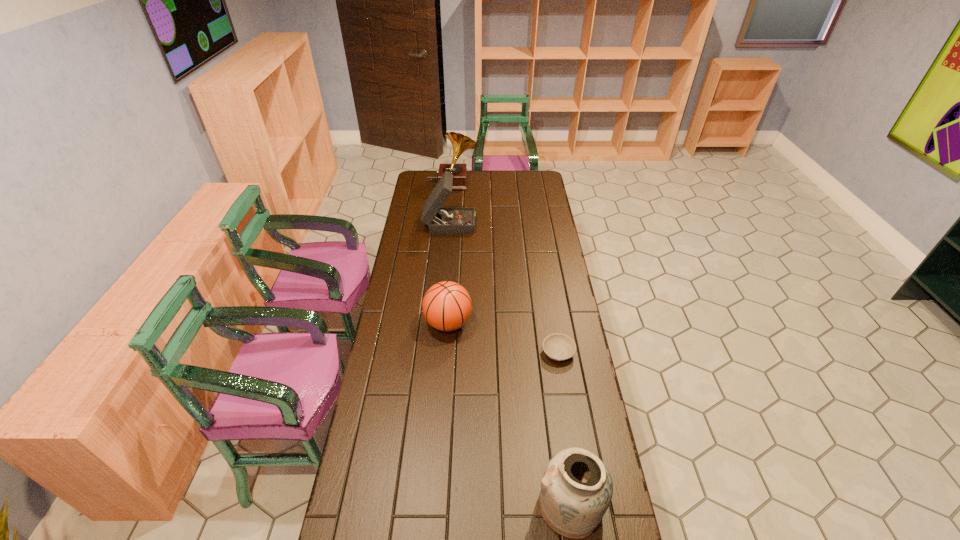
Where is `object present at the far edge`? This screenshot has height=540, width=960. object present at the far edge is located at coordinates (460, 143).

You are a GUI agent. You are given a task and a screenshot of the screen. Output one action in this format:
    pyautogui.click(x=<x>, y=<y>)
    Task: Click on the basketball that is at the left edge
    Image resolution: width=960 pixels, height=540 pixels.
    Given the screenshot: What is the action you would take?
    pyautogui.click(x=447, y=306)

Where is `object present at the right edge`? object present at the right edge is located at coordinates (557, 346).

Image resolution: width=960 pixels, height=540 pixels. Identify the location of object located at the far left corner. (460, 143).

I want to click on vacant area at the far edge, so click(x=474, y=183).

Where is `vacant space at the left edge of the desktop`? vacant space at the left edge of the desktop is located at coordinates (410, 341).

The width and height of the screenshot is (960, 540). Find the location of `free region at the right edge`. free region at the right edge is located at coordinates (545, 246).

You are a GUI agent. You are given a task and a screenshot of the screen. Output one action in this format:
    pyautogui.click(x=<x>, y=<y>)
    Task: Click on the free space between the nearer phonograph_record and the basketball
    This screenshot has height=540, width=960.
    Given the screenshot: What is the action you would take?
    pyautogui.click(x=449, y=273)

Where is `free space that is in between the basketball and the nearer phonograph_record`? The height and width of the screenshot is (540, 960). free space that is in between the basketball and the nearer phonograph_record is located at coordinates (449, 273).

At what (x,y) coordinates should I click in order to perform the action: click on vacant area that lies between the taller phonograph_record and the second shortest object. Please return your answer as a coordinate pair (x, y). Looking at the image, I should click on [450, 253].